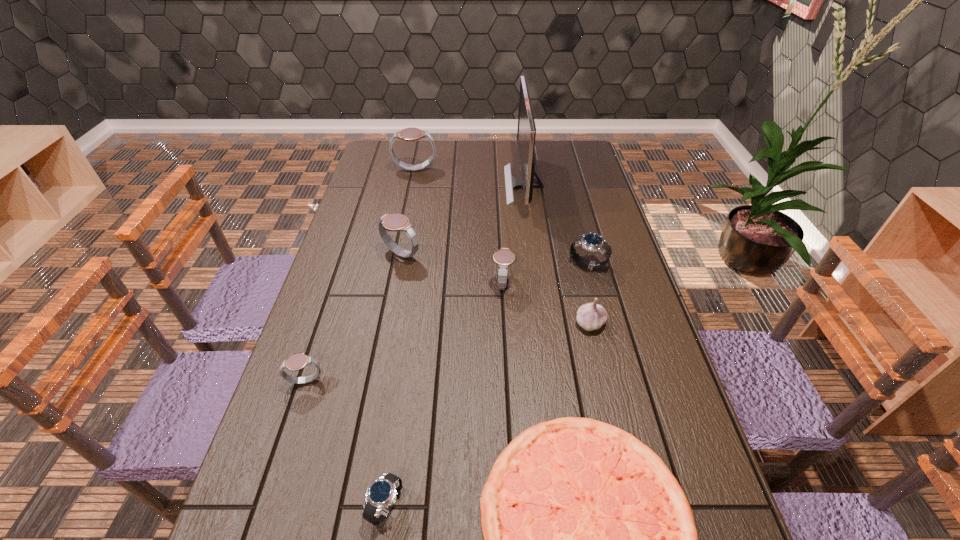
Where is `vacant space at the far edge of the desktop`? The height and width of the screenshot is (540, 960). vacant space at the far edge of the desktop is located at coordinates (445, 168).

Identify the location of free spot at the left edge of the desktop. This screenshot has width=960, height=540. (363, 323).

Identify the location of vacant space at the right edge. This screenshot has width=960, height=540. (606, 213).

You are a GUI agent. You are given a task and a screenshot of the screen. Output one action in this format:
    pyautogui.click(x=<x>, y=<y>)
    Task: Click on the blank space at the far right corner
    
    Given the screenshot: What is the action you would take?
    pyautogui.click(x=590, y=155)

The image size is (960, 540). Identify the location of vacant region between the tallest object and the second tallest watch. (463, 220).

Locate an element on the screen. This screenshot has width=960, height=540. vacant space that's between the smaller silver watch and the tallest object is located at coordinates (455, 346).

Locate an element on the screen. The height and width of the screenshot is (540, 960). free space between the rightmost watch and the fourth nearest object is located at coordinates (588, 294).

This screenshot has height=540, width=960. Find the location of `free spot between the third smallest gray watch and the leftmost gray watch`. free spot between the third smallest gray watch and the leftmost gray watch is located at coordinates (353, 318).

This screenshot has width=960, height=540. Identify the location of empty space between the second tallest object and the right silver watch. (501, 218).

I want to click on free space that is in between the left silver watch and the white garlic, so (x=488, y=415).